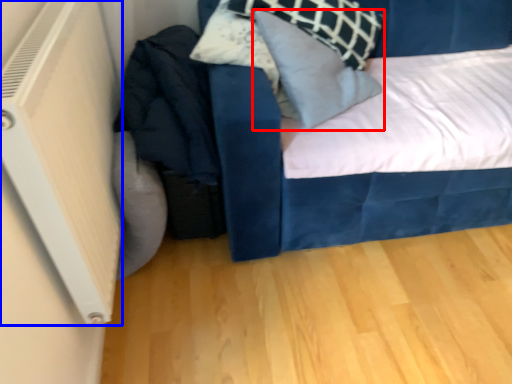
Question: Which object appears closest to the camera in this image, pillow (highlighted by a red box) or air conditioning (highlighted by a blue box)?

Choices:
 (A) pillow
 (B) air conditioning

Answer: (B)